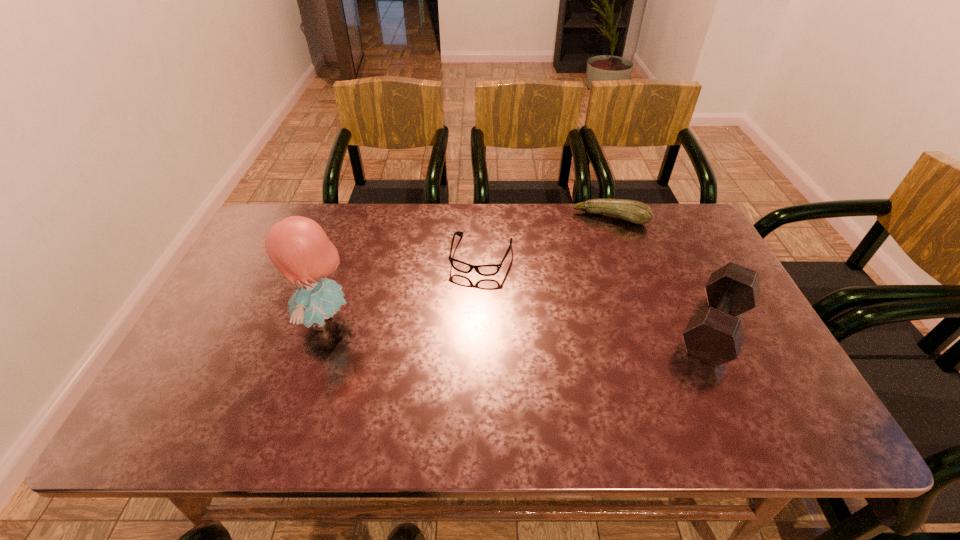
This screenshot has height=540, width=960. I want to click on vacant region that satisfies the following two spatial constraints: 1. on the front side of the farthest object; 2. on the right side of the dumbbell, so click(649, 327).

Image resolution: width=960 pixels, height=540 pixels. Find the location of `blank area in the image that satisfies the following two spatial constraints: 1. on the back side of the spectacles; 2. on the right side of the second shortest object`. blank area in the image that satisfies the following two spatial constraints: 1. on the back side of the spectacles; 2. on the right side of the second shortest object is located at coordinates (481, 218).